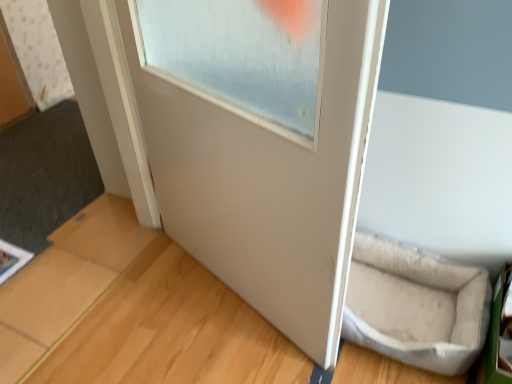
The image size is (512, 384). Identify the location of vacant space situated on the left part of white matte door at center. (143, 314).